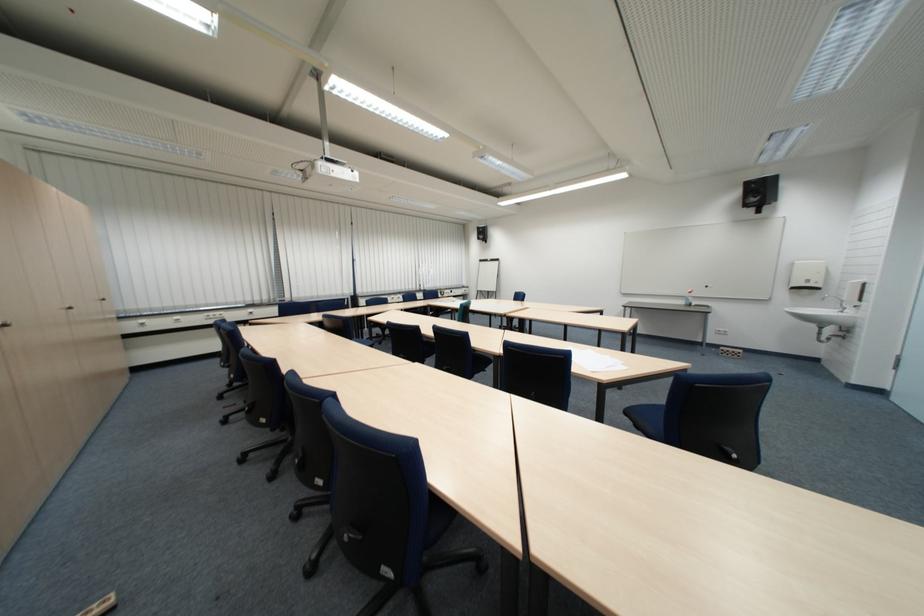
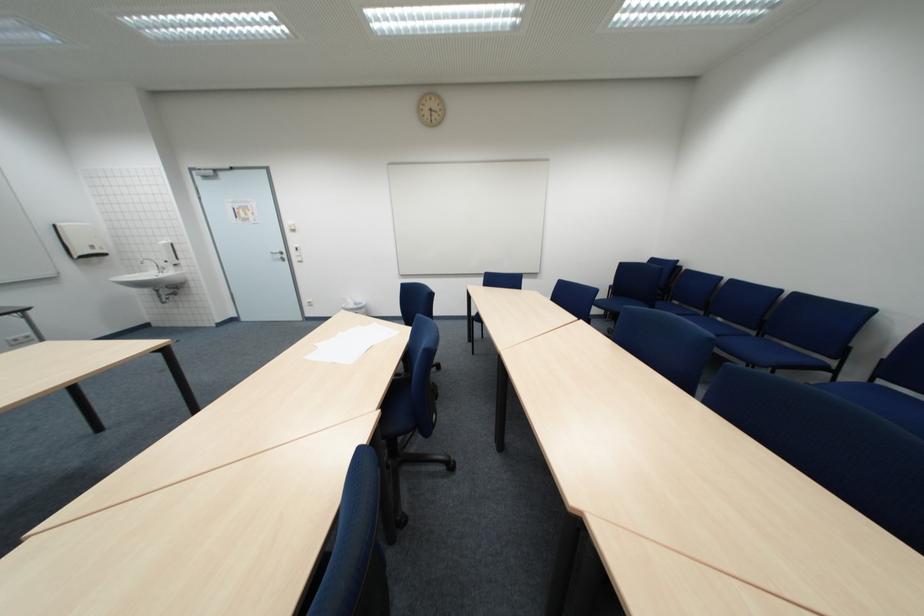
The point at (821, 282) is marked in the first image. Where is the corresponding point in the second image?

(105, 248)